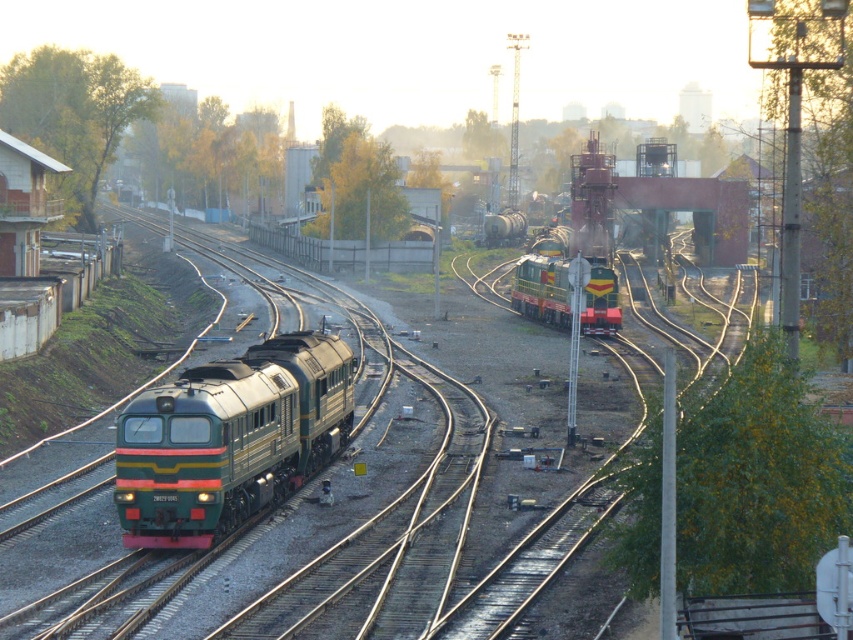
You are a railway engineer assessing the space between two tracks. You see a green metallic train at left and a green metallic locomotive at center. Which one is larger in size?

The green metallic train at left is bigger than the green metallic locomotive at center according to the description.

You are standing at the center of the railway yard and see the green matte train at left. Based on its position coordinates, is the train closer to the left edge or the right edge of the image?

The green matte train at left is located at point coordinates of 0.686 on the x axis and 0.270 on the y axis. Since the x coordinate is 0.686, which is closer to 1.0 than 0.0, the train is closer to the right edge of the image.

You are a railway worker standing at the edge of the tracks. You see the green matte train at left and the green metallic locomotive at center. Which one is positioned more to the left side of the tracks?

The green matte train at left is positioned more to the left side of the tracks than the green metallic locomotive at center.